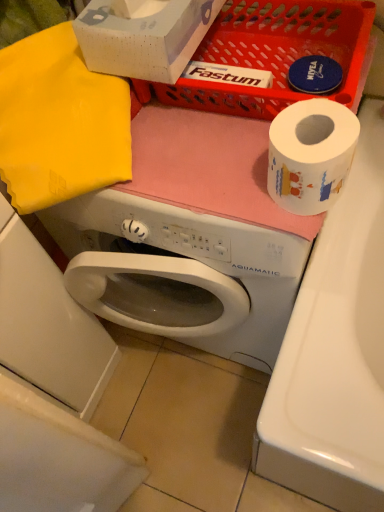
Question: Can you confirm if white glossy washing machine at lower left is shorter than white matte toilet paper at upper right?

Choices:
 (A) yes
 (B) no

Answer: (B)

Question: Does white glossy washing machine at lower left lie behind white matte toilet paper at upper right?

Choices:
 (A) yes
 (B) no

Answer: (A)

Question: Considering the relative positions of white glossy washing machine at lower left and white matte toilet paper at upper right in the image provided, is white glossy washing machine at lower left to the right of white matte toilet paper at upper right from the viewer's perspective?

Choices:
 (A) yes
 (B) no

Answer: (B)

Question: From the image's perspective, would you say white glossy washing machine at lower left is shown under white matte toilet paper at upper right?

Choices:
 (A) yes
 (B) no

Answer: (A)

Question: Could you tell me if white glossy washing machine at lower left is facing white matte toilet paper at upper right?

Choices:
 (A) no
 (B) yes

Answer: (A)

Question: Considering the relative positions of matte plastic basket at upper center and white matte toilet paper at upper right in the image provided, is matte plastic basket at upper center to the left or to the right of white matte toilet paper at upper right?

Choices:
 (A) left
 (B) right

Answer: (A)

Question: From the image's perspective, is matte plastic basket at upper center located above or below white matte toilet paper at upper right?

Choices:
 (A) below
 (B) above

Answer: (B)

Question: In the image, is matte plastic basket at upper center positioned in front of or behind white matte toilet paper at upper right?

Choices:
 (A) front
 (B) behind

Answer: (B)

Question: Considering the positions of matte plastic basket at upper center and white matte toilet paper at upper right in the image, is matte plastic basket at upper center wider or thinner than white matte toilet paper at upper right?

Choices:
 (A) thin
 (B) wide

Answer: (B)

Question: Would you say white matte toilet paper at upper right is to the left or to the right of yellow fabric at upper left in the picture?

Choices:
 (A) left
 (B) right

Answer: (B)

Question: Is white matte toilet paper at upper right spatially inside yellow fabric at upper left, or outside of it?

Choices:
 (A) outside
 (B) inside

Answer: (A)

Question: From a real-world perspective, is white matte toilet paper at upper right positioned above or below yellow fabric at upper left?

Choices:
 (A) below
 (B) above

Answer: (B)

Question: Is point (326, 192) positioned closer to the camera than point (87, 181)?

Choices:
 (A) farther
 (B) closer

Answer: (B)

Question: Considering the positions of white glossy washing machine at lower left and yellow fabric at upper left in the image, is white glossy washing machine at lower left taller or shorter than yellow fabric at upper left?

Choices:
 (A) short
 (B) tall

Answer: (B)

Question: From a real-world perspective, relative to yellow fabric at upper left, is white glossy washing machine at lower left vertically above or below?

Choices:
 (A) below
 (B) above

Answer: (A)